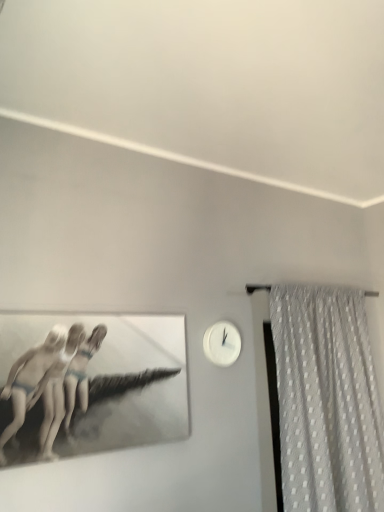
Where is `white dotted fabric at right`? This screenshot has width=384, height=512. white dotted fabric at right is located at coordinates (327, 401).

The image size is (384, 512). What do you see at coordinates (327, 401) in the screenshot? I see `white dotted fabric at right` at bounding box center [327, 401].

Describe the element at coordinates (222, 343) in the screenshot. I see `white glossy clock at upper right` at that location.

In order to face white glossy clock at upper right, should I rotate leftwards or rightwards?

Turn right approximately 4.128 degrees to face it.

At what (x,y) coordinates should I click in order to perform the action: click on white glossy clock at upper right. Please return your answer as a coordinate pair (x, y). Looking at the image, I should click on (222, 343).

The height and width of the screenshot is (512, 384). I want to click on white dotted fabric at right, so click(x=327, y=401).

Does white glossy clock at upper right appear on the left side of white dotted fabric at right?

Yes, white glossy clock at upper right is to the left of white dotted fabric at right.

Considering their positions, is white glossy clock at upper right located in front of or behind white dotted fabric at right?

In the image, white glossy clock at upper right appears behind white dotted fabric at right.

Does point (228, 329) lie behind point (282, 424)?

That is True.

From the picture: From the image's perspective, between white glossy clock at upper right and white dotted fabric at right, who is located below?

From the image's view, white dotted fabric at right is below.

From a real-world perspective, is white glossy clock at upper right physically above white dotted fabric at right?

Yes, from a real-world perspective, white glossy clock at upper right is on top of white dotted fabric at right.

Considering the relative sizes of white glossy clock at upper right and white dotted fabric at right in the image provided, is white glossy clock at upper right wider than white dotted fabric at right?

No.

Between white glossy clock at upper right and white dotted fabric at right, which one has less height?

white glossy clock at upper right.

Can you confirm if white glossy clock at upper right is bigger than white dotted fabric at right?

No.

Choose the correct answer: Is white glossy clock at upper right inside white dotted fabric at right or outside it?

The correct answer is: outside.

Does white glossy clock at upper right touch white dotted fabric at right?

No, white glossy clock at upper right is not in contact with white dotted fabric at right.

Is white glossy clock at upper right oriented towards white dotted fabric at right?

No, white glossy clock at upper right is not aimed at white dotted fabric at right.

Identify the location of clock that is above the white dotted fabric at right (from a real-world perspective). This screenshot has height=512, width=384. pyautogui.click(x=222, y=343).

Visually, is white dotted fabric at right positioned to the left or to the right of white glossy clock at upper right?

From the image, it's evident that white dotted fabric at right is to the right of white glossy clock at upper right.

Which object is further away from the camera, white dotted fabric at right or white glossy clock at upper right?

white glossy clock at upper right.

Is point (382, 508) more distant than point (236, 355)?

No.

From the image's perspective, is white dotted fabric at right on white glossy clock at upper right?

No, from the image's perspective, white dotted fabric at right is not on top of white glossy clock at upper right.

From a real-world perspective, is white dotted fabric at right physically above white glossy clock at upper right?

Incorrect, from a real-world perspective, white dotted fabric at right is lower than white glossy clock at upper right.

Which of these two, white dotted fabric at right or white glossy clock at upper right, is thinner?

white glossy clock at upper right.

Considering the sizes of white dotted fabric at right and white glossy clock at upper right in the image, is white dotted fabric at right taller or shorter than white glossy clock at upper right?

Clearly, white dotted fabric at right is taller compared to white glossy clock at upper right.

In terms of size, does white dotted fabric at right appear bigger or smaller than white glossy clock at upper right?

white dotted fabric at right is bigger than white glossy clock at upper right.

Would you say white dotted fabric at right contains white glossy clock at upper right?

Actually, white glossy clock at upper right is outside white dotted fabric at right.

Would you say white dotted fabric at right is a long distance from white glossy clock at upper right?

No, there isn't a large distance between white dotted fabric at right and white glossy clock at upper right.

Looking at this image, is white dotted fabric at right turned away from white glossy clock at upper right?

That's not correct — white dotted fabric at right is not looking away from white glossy clock at upper right.

Where is `clock above the white dotted fabric at right (from the image's perspective)`? clock above the white dotted fabric at right (from the image's perspective) is located at coordinates (222, 343).

This screenshot has height=512, width=384. There is a white dotted fabric at right. Identify the location of clock above it (from a real-world perspective). (222, 343).

This screenshot has height=512, width=384. In the image, there is a white dotted fabric at right. Identify the location of clock above it (from the image's perspective). (222, 343).